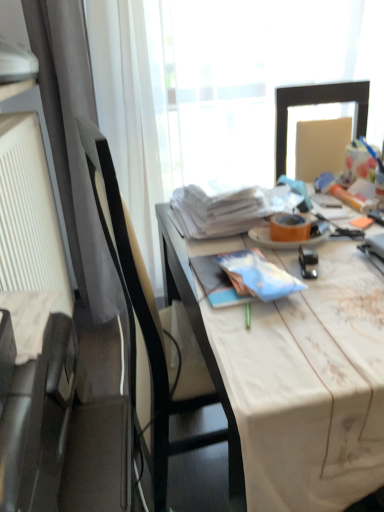
Question: Is white fabric-covered desk at center positioned behind orange matte plate at center?

Choices:
 (A) yes
 (B) no

Answer: (B)

Question: Is white fabric-covered desk at center turned away from orange matte plate at center?

Choices:
 (A) yes
 (B) no

Answer: (B)

Question: Is white fabric-covered desk at center at the left side of orange matte plate at center?

Choices:
 (A) yes
 (B) no

Answer: (B)

Question: Can you confirm if white fabric-covered desk at center is bigger than orange matte plate at center?

Choices:
 (A) no
 (B) yes

Answer: (B)

Question: Does white fabric-covered desk at center have a lesser height compared to orange matte plate at center?

Choices:
 (A) no
 (B) yes

Answer: (A)

Question: Is white fabric-covered desk at center oriented towards orange matte plate at center?

Choices:
 (A) yes
 (B) no

Answer: (B)

Question: Can you see orange matte plate at center touching metallic black stapler at center-right?

Choices:
 (A) no
 (B) yes

Answer: (B)

Question: Is orange matte plate at center positioned behind metallic black stapler at center-right?

Choices:
 (A) yes
 (B) no

Answer: (A)

Question: Can you confirm if orange matte plate at center is shorter than metallic black stapler at center-right?

Choices:
 (A) yes
 (B) no

Answer: (A)

Question: Is orange matte plate at center facing towards metallic black stapler at center-right?

Choices:
 (A) yes
 (B) no

Answer: (A)

Question: Is orange matte plate at center closer to the viewer compared to metallic black stapler at center-right?

Choices:
 (A) yes
 (B) no

Answer: (B)

Question: From the image's perspective, is orange matte plate at center beneath metallic black stapler at center-right?

Choices:
 (A) no
 (B) yes

Answer: (A)

Question: Does white fabric-covered desk at center have a greater height compared to black leather chair at left?

Choices:
 (A) yes
 (B) no

Answer: (B)